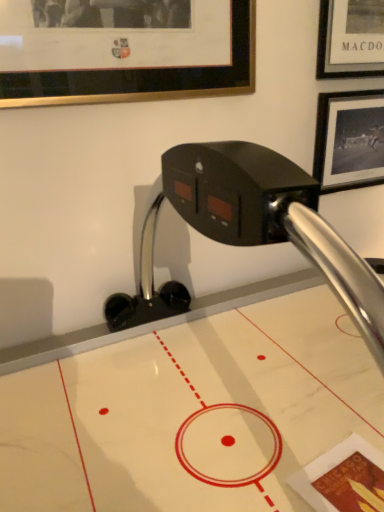
Question: From the image's perspective, is gold-framed picture at upper left, which is counted as the 1th picture frame, starting from the front, below black matte picture frame at upper right, the 2th picture frame in the left-to-right sequence?

Choices:
 (A) no
 (B) yes

Answer: (A)

Question: Considering the relative sizes of gold-framed picture at upper left, which is counted as the 1th picture frame, starting from the front, and black matte picture frame at upper right, the 2th picture frame in the left-to-right sequence, in the image provided, is gold-framed picture at upper left, which is counted as the 1th picture frame, starting from the front, thinner than black matte picture frame at upper right, the 2th picture frame in the left-to-right sequence,?

Choices:
 (A) no
 (B) yes

Answer: (B)

Question: Can you confirm if gold-framed picture at upper left, the 1th picture frame from the left, is wider than black matte picture frame at upper right, placed as the 1th picture frame when sorted from right to left?

Choices:
 (A) no
 (B) yes

Answer: (A)

Question: Is gold-framed picture at upper left, the 1th picture frame from the left, facing away from black matte picture frame at upper right, the 2th picture frame in the left-to-right sequence?

Choices:
 (A) no
 (B) yes

Answer: (A)

Question: From a real-world perspective, is gold-framed picture at upper left, the 1th picture frame from the left, over black matte picture frame at upper right, the 2th picture frame viewed from the front?

Choices:
 (A) yes
 (B) no

Answer: (A)

Question: Can you see gold-framed picture at upper left, the second picture frame positioned from the back, touching black matte picture frame at upper right, the 2th picture frame in the left-to-right sequence?

Choices:
 (A) yes
 (B) no

Answer: (B)

Question: From a real-world perspective, is white marble air hockey table at center on top of black matte picture frame at upper right, the first picture frame from the back?

Choices:
 (A) yes
 (B) no

Answer: (B)

Question: Can you confirm if white marble air hockey table at center is wider than black matte picture frame at upper right, the 2th picture frame in the left-to-right sequence?

Choices:
 (A) no
 (B) yes

Answer: (B)

Question: Is white marble air hockey table at center at the left side of black matte picture frame at upper right, placed as the 1th picture frame when sorted from right to left?

Choices:
 (A) no
 (B) yes

Answer: (B)

Question: Is white marble air hockey table at center oriented towards black matte picture frame at upper right, the first picture frame from the back?

Choices:
 (A) no
 (B) yes

Answer: (A)

Question: Does white marble air hockey table at center have a lesser height compared to black matte picture frame at upper right, the 2th picture frame in the left-to-right sequence?

Choices:
 (A) yes
 (B) no

Answer: (B)

Question: Is white marble air hockey table at center facing away from black matte picture frame at upper right, placed as the 1th picture frame when sorted from right to left?

Choices:
 (A) no
 (B) yes

Answer: (B)

Question: Is white marble air hockey table at center placed right next to gold-framed picture at upper left, which is counted as the 1th picture frame, starting from the front?

Choices:
 (A) yes
 (B) no

Answer: (B)